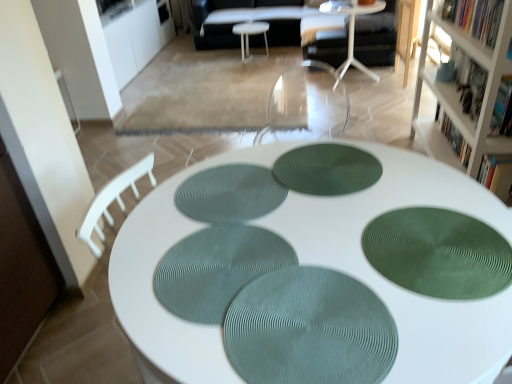
Where is `vacant space situated above green textured placemat at center, the 4th mat from the right (from a real-world perspective)`? This screenshot has height=384, width=512. vacant space situated above green textured placemat at center, the 4th mat from the right (from a real-world perspective) is located at coordinates (229, 192).